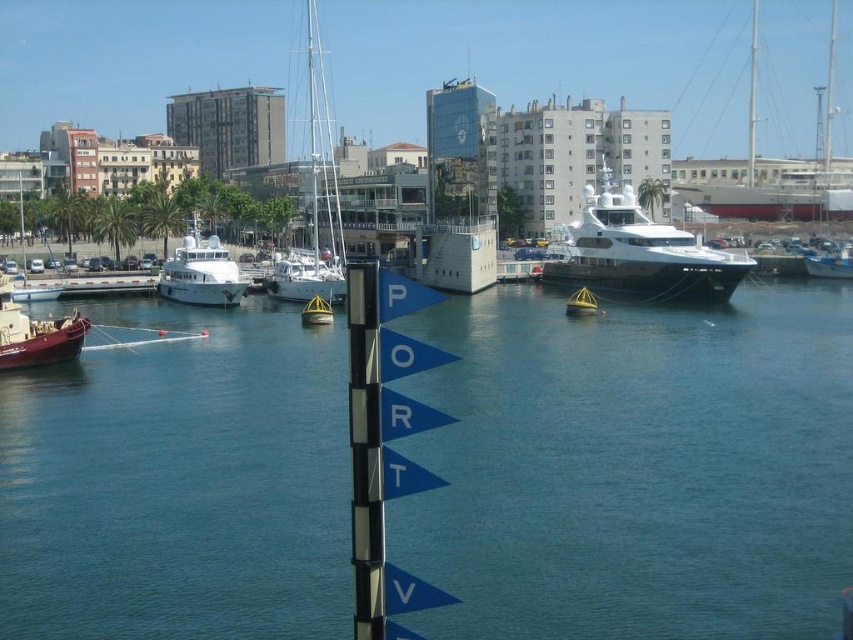
You are a tour guide explaining the harbor to visitors. You point out the white glossy yacht at center and the white glossy boat at right. Which one would you describe as the bigger vessel?

The white glossy yacht at center is larger in size than the white glossy boat at right.

You are a tour guide explaining the harbor layout. Pointing at the white glossy sailboat at center, you want to inform visitors about its exact position using coordinates. What coordinates should you mention?

The white glossy sailboat at center is located at point (x=316, y=196).

Looking at this image, you are a photographer planning to take a photo of the harbor scene. You want to ensure both the metallic red boat at lower left and the white glossy boat at right are clearly visible. Based on their positions, which boat should you focus on first to ensure both are in frame?

The metallic red boat at lower left is in front of the white glossy boat at right, so focusing on the metallic red boat at lower left first will ensure both are visible in the frame.